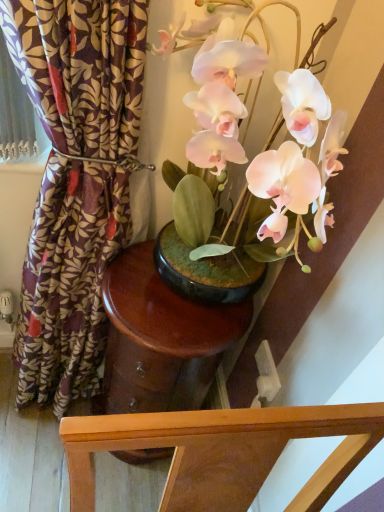
Question: From the image's perspective, is matte pink orchid at center above or below purple floral fabric at left?

Choices:
 (A) below
 (B) above

Answer: (B)

Question: In the image, is matte pink orchid at center positioned in front of or behind purple floral fabric at left?

Choices:
 (A) behind
 (B) front

Answer: (B)

Question: Based on their relative distances, which object is farther from the purple floral fabric at left?

Choices:
 (A) glossy wood side table at center
 (B) matte pink orchid at center
 (C) white plastic power outlet at lower right

Answer: (C)

Question: Estimate the real-world distances between objects in this image. Which object is farther from the matte pink orchid at center?

Choices:
 (A) glossy wood side table at center
 (B) purple floral fabric at left
 (C) white plastic power outlet at lower right

Answer: (C)